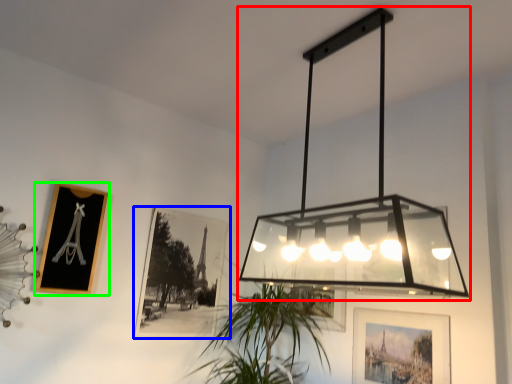
Question: Which object is the closest to the lamp (highlighted by a red box)? Choose among these: picture frame (highlighted by a blue box) or picture frame (highlighted by a green box).

Choices:
 (A) picture frame
 (B) picture frame

Answer: (A)